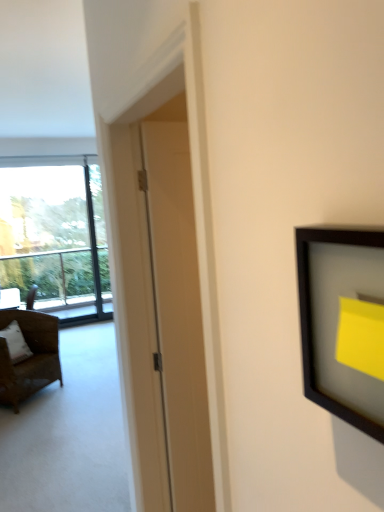
Question: Considering the positions of point (180, 501) and point (49, 290), is point (180, 501) closer or farther from the camera than point (49, 290)?

Choices:
 (A) closer
 (B) farther

Answer: (A)

Question: Is white matte door at center situated inside transparent glass window at left or outside?

Choices:
 (A) outside
 (B) inside

Answer: (A)

Question: Based on their relative distances, which object is farther from the transparent glass window at left?

Choices:
 (A) white matte door at center
 (B) brown wicker chair at left
 (C) white fabric pillow at left

Answer: (A)

Question: Which object is positioned closest to the brown wicker chair at left?

Choices:
 (A) white matte door at center
 (B) white fabric pillow at left
 (C) transparent glass window at left

Answer: (B)